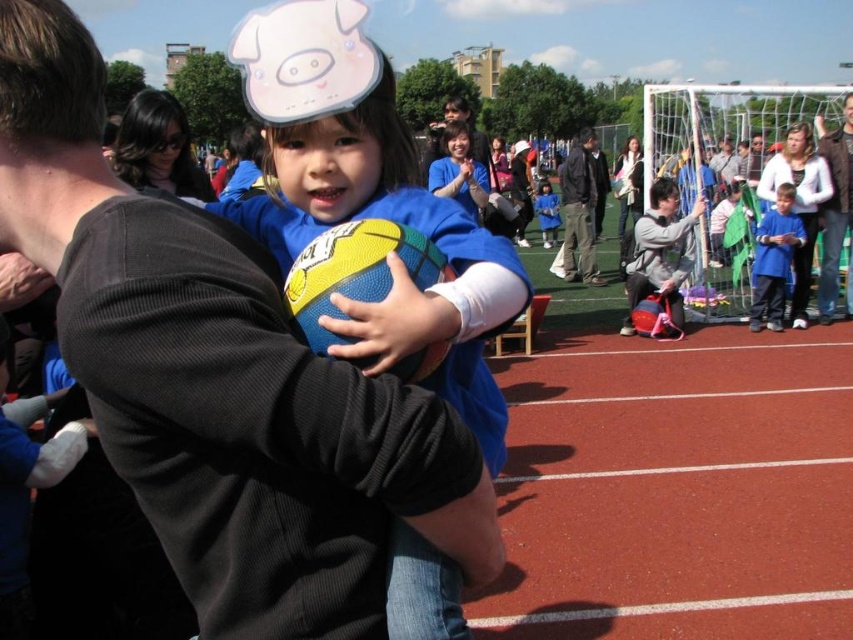
You are a photographer setting up a camera to capture the child in the blue fabric shirt at center and the adult wearing the dark gray jacket at center. The camera has a focus range of 1.2 meters. Can both the child and the adult be in focus at the same time?

The dark gray jacket at center might be wider than blue fabric shirt at center, but the camera focus range is 1.2 meters. Since the question does not provide information about their distance from the camera, it is impossible to determine if both can be in focus simultaneously.

From the picture: You are a photographer trying to capture a photo of the blue fabric shirt at right and the blue denim jacket at center. Which object should you focus on first if you want to ensure both are in focus without adjusting the camera settings?

The blue fabric shirt at right is closer to the viewer than the blue denim jacket at center. To ensure both are in focus, you should focus on the blue denim jacket at center because it is further away, allowing the depth of field to cover both objects.

You are a photographer standing at the edge of the sports field. You see the dark gray jacket at center and the blue fabric shirt at center. Which one is higher up in the picture?

The dark gray jacket at center is taller than the blue fabric shirt at center, so the dark gray jacket at center is higher up in the picture.